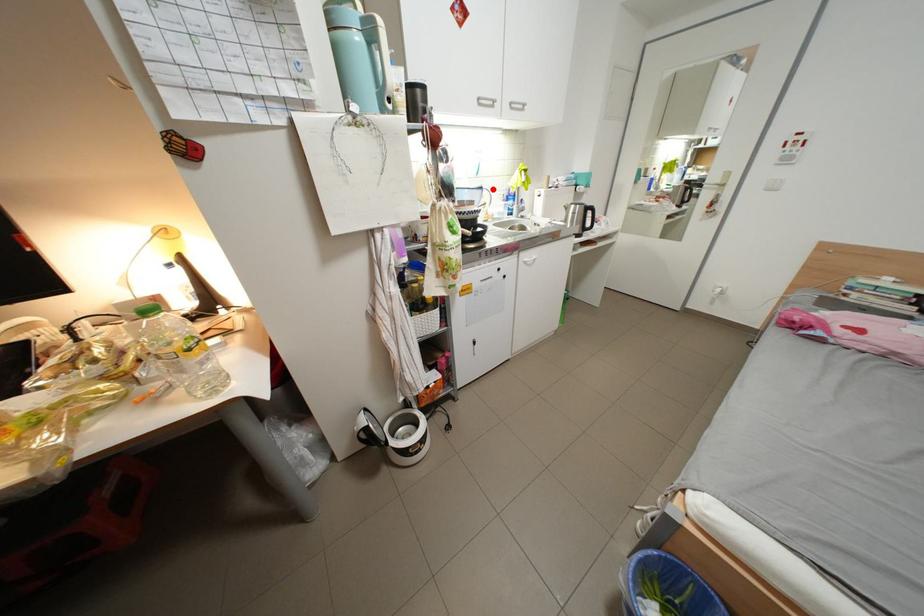
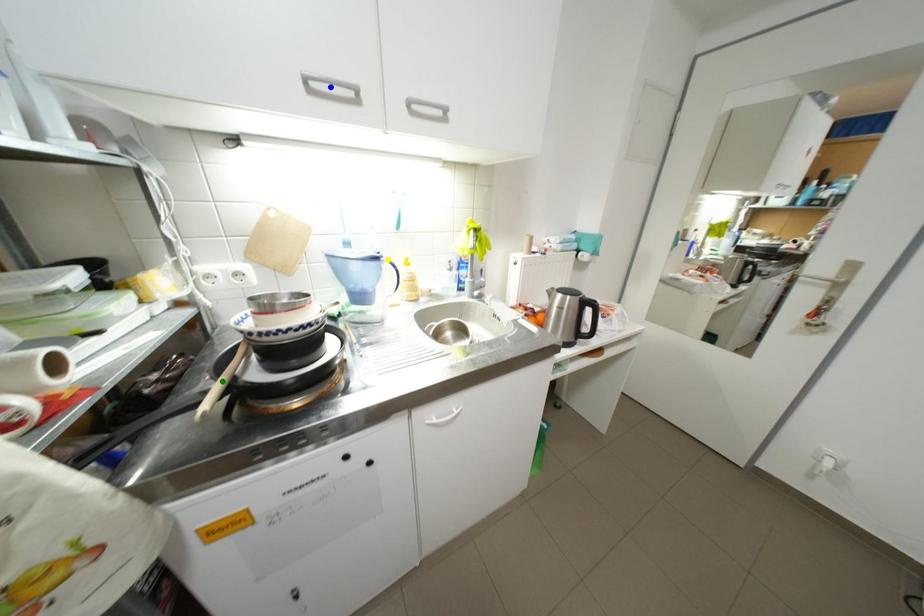
Question: I am providing you with two images of the same scene from different viewpoints. A red point is marked on the first image. You are given multiple points on the second image. In image 2, which mark is for the same physical point as the one in image 1?

Choices:
 (A) green point
 (B) blue point
 (C) yellow point

Answer: (C)